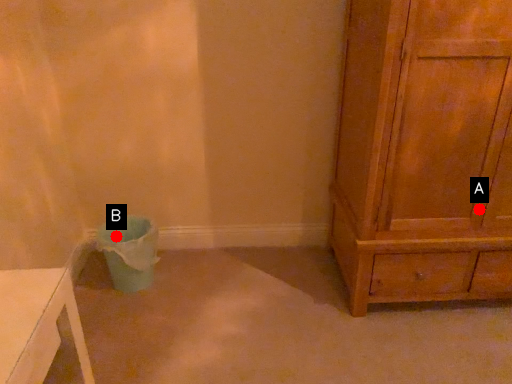
Question: Two points are circled on the image, labeled by A and B beside each circle. Which point is closer to the camera?

Choices:
 (A) A is closer
 (B) B is closer

Answer: (A)